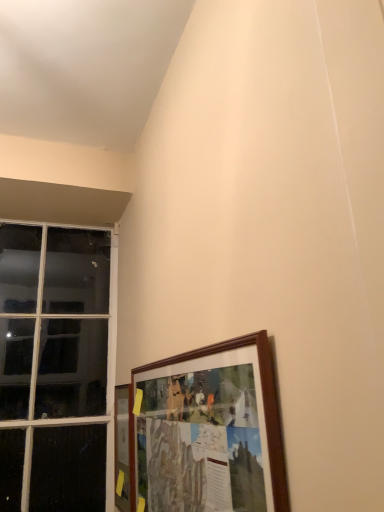
Question: Is clear glass window at left beside wooden picture frame at lower left, which is the first picture frame in left-to-right order?

Choices:
 (A) no
 (B) yes

Answer: (A)

Question: Is wooden picture frame at lower left, which is the first picture frame in left-to-right order, a part of clear glass window at left?

Choices:
 (A) yes
 (B) no

Answer: (B)

Question: Is clear glass window at left facing towards wooden picture frame at lower left, which is the first picture frame in back-to-front order?

Choices:
 (A) yes
 (B) no

Answer: (A)

Question: Is clear glass window at left far away from wooden picture frame at lower left, which is the first picture frame in left-to-right order?

Choices:
 (A) no
 (B) yes

Answer: (A)

Question: Considering the relative sizes of clear glass window at left and wooden picture frame at lower left, which is counted as the second picture frame, starting from the right, in the image provided, is clear glass window at left bigger than wooden picture frame at lower left, which is counted as the second picture frame, starting from the right,?

Choices:
 (A) yes
 (B) no

Answer: (A)

Question: From a real-world perspective, is clear glass window at left physically located above or below wooden frame at lower right, which is counted as the 2th picture frame, starting from the back?

Choices:
 (A) above
 (B) below

Answer: (A)

Question: Relative to wooden frame at lower right, which is counted as the 2th picture frame, starting from the back, is clear glass window at left in front or behind?

Choices:
 (A) behind
 (B) front

Answer: (A)

Question: Is point (8, 431) closer or farther from the camera than point (264, 489)?

Choices:
 (A) farther
 (B) closer

Answer: (A)

Question: From the image's perspective, is clear glass window at left above or below wooden frame at lower right, which is counted as the 2th picture frame, starting from the back?

Choices:
 (A) above
 (B) below

Answer: (A)

Question: Considering the positions of wooden picture frame at lower left, which is counted as the second picture frame, starting from the right, and wooden frame at lower right, the 1th picture frame viewed from the right, in the image, is wooden picture frame at lower left, which is counted as the second picture frame, starting from the right, bigger or smaller than wooden frame at lower right, the 1th picture frame viewed from the right,?

Choices:
 (A) small
 (B) big

Answer: (A)

Question: From a real-world perspective, relative to wooden frame at lower right, marked as the 2th picture frame in a left-to-right arrangement, is wooden picture frame at lower left, which is counted as the second picture frame, starting from the right, vertically above or below?

Choices:
 (A) below
 (B) above

Answer: (A)

Question: Is wooden picture frame at lower left, which is the first picture frame in back-to-front order, taller or shorter than wooden frame at lower right, positioned as the 1th picture frame in front-to-back order?

Choices:
 (A) tall
 (B) short

Answer: (B)

Question: Considering the positions of wooden picture frame at lower left, which is counted as the second picture frame, starting from the right, and wooden frame at lower right, marked as the 2th picture frame in a left-to-right arrangement, in the image, is wooden picture frame at lower left, which is counted as the second picture frame, starting from the right, wider or thinner than wooden frame at lower right, marked as the 2th picture frame in a left-to-right arrangement,?

Choices:
 (A) thin
 (B) wide

Answer: (A)

Question: Considering the positions of wooden picture frame at lower left, which is the second picture frame from front to back, and clear glass window at left in the image, is wooden picture frame at lower left, which is the second picture frame from front to back, bigger or smaller than clear glass window at left?

Choices:
 (A) small
 (B) big

Answer: (A)

Question: Is point (117, 412) closer or farther from the camera than point (0, 311)?

Choices:
 (A) farther
 (B) closer

Answer: (B)